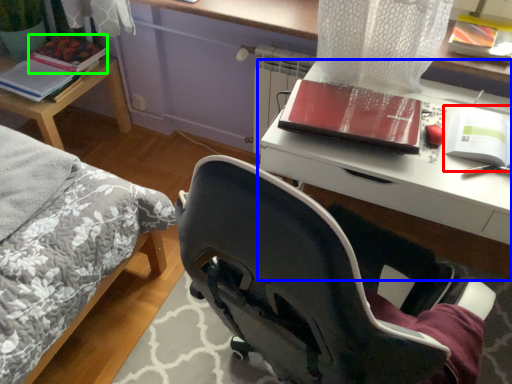
Question: Which is farther away from paperback book (highlighted by a red box)? desk (highlighted by a blue box) or paperback book (highlighted by a green box)?

Choices:
 (A) desk
 (B) paperback book

Answer: (B)